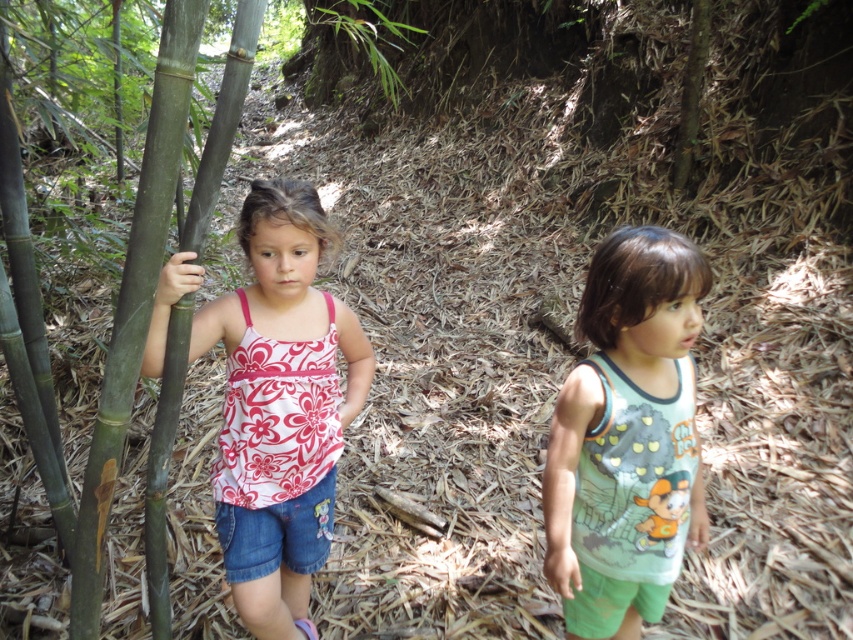
Question: Which point is farther to the camera?

Choices:
 (A) (674, 429)
 (B) (155, 564)
 (C) (299, 250)

Answer: (B)

Question: Among these points, which one is farthest from the camera?

Choices:
 (A) (672, 448)
 (B) (202, 228)

Answer: (A)

Question: Does floral-patterned tank top at left have a lesser width compared to green cotton tank top at center?

Choices:
 (A) no
 (B) yes

Answer: (B)

Question: Is green cotton tank top at center to the left of green smooth bamboo at left from the viewer's perspective?

Choices:
 (A) yes
 (B) no

Answer: (B)

Question: From the image, what is the correct spatial relationship of green cotton tank top at center in relation to green smooth bamboo at left?

Choices:
 (A) left
 (B) right

Answer: (B)

Question: Which point is farther to the camera?

Choices:
 (A) (625, 604)
 (B) (259, 278)

Answer: (A)